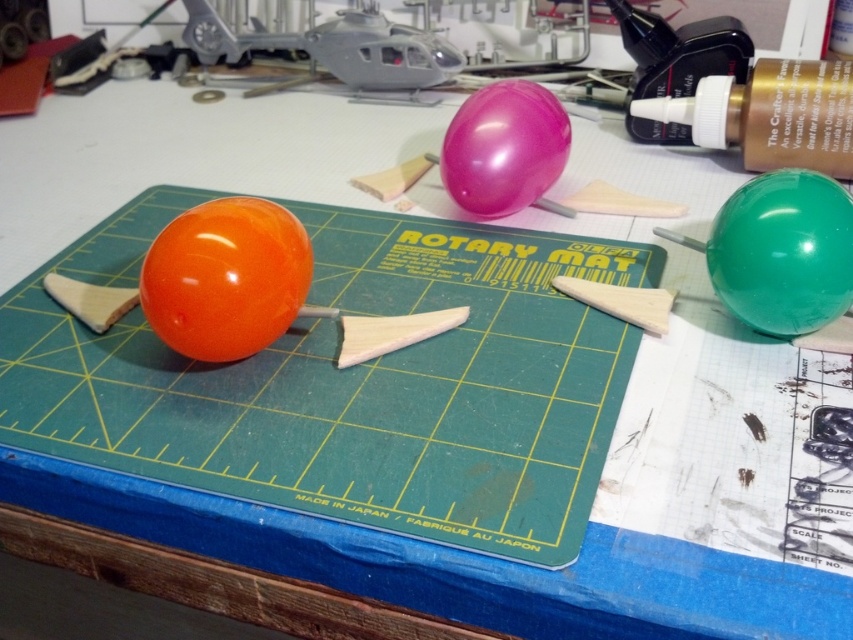
Question: Does green glossy balloon at right appear under glossy rubber balloon at center?

Choices:
 (A) no
 (B) yes

Answer: (B)

Question: Among these points, which one is nearest to the camera?

Choices:
 (A) (199, 307)
 (B) (473, 195)
 (C) (746, 218)

Answer: (A)

Question: Is orange glossy balloon at center in front of glossy rubber balloon at center?

Choices:
 (A) no
 (B) yes

Answer: (B)

Question: Does orange glossy balloon at center have a larger size compared to green glossy balloon at right?

Choices:
 (A) yes
 (B) no

Answer: (A)

Question: Which of the following is the farthest from the observer?

Choices:
 (A) green glossy balloon at right
 (B) glossy rubber balloon at center

Answer: (B)

Question: Which is nearer to the glossy rubber balloon at center?

Choices:
 (A) orange glossy balloon at center
 (B) green glossy balloon at right

Answer: (B)